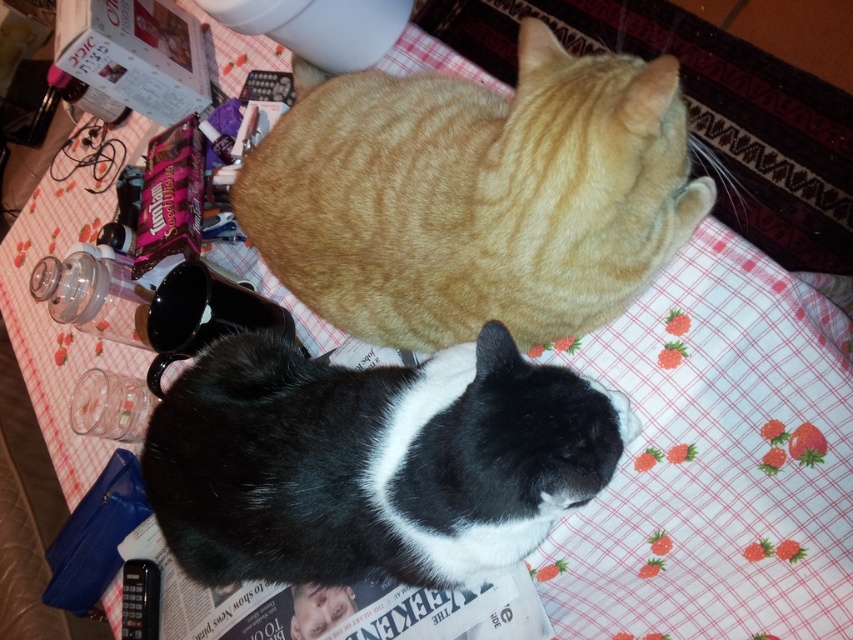
Does orange tabby cat at upper center appear under black and white fur cat at center?

Actually, orange tabby cat at upper center is above black and white fur cat at center.

Can you confirm if orange tabby cat at upper center is wider than black and white fur cat at center?

Yes.

Where is `orange tabby cat at upper center`? orange tabby cat at upper center is located at coordinates 474,195.